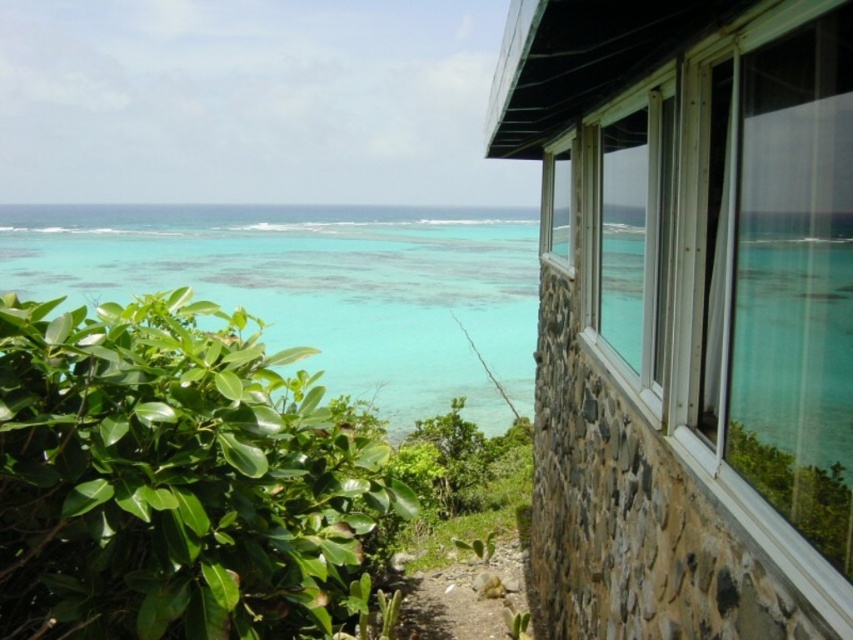
Does translucent water at lower left have a lesser height compared to clear glass window at upper right?

No, translucent water at lower left is not shorter than clear glass window at upper right.

Which is more to the right, translucent water at lower left or clear glass window at upper right?

Positioned to the right is clear glass window at upper right.

Where is `translucent water at lower left`? translucent water at lower left is located at coordinates (318, 288).

From the picture: Between green spiky cactus at lower center and clear glass window at upper right, which one is positioned higher?

clear glass window at upper right

Who is positioned more to the left, green spiky cactus at lower center or clear glass window at upper right?

green spiky cactus at lower center is more to the left.

The height and width of the screenshot is (640, 853). What do you see at coordinates (467, 595) in the screenshot?
I see `green spiky cactus at lower center` at bounding box center [467, 595].

At what (x,y) coordinates should I click in order to perform the action: click on green spiky cactus at lower center. Please return your answer as a coordinate pair (x, y). Looking at the image, I should click on (467, 595).

Is point (337, 237) more distant than point (459, 588)?

Yes, it is.

Is translucent water at lower left below green spiky cactus at lower center?

No.

Does point (73, 244) come farther from viewer compared to point (483, 576)?

Yes.

Find the location of a particular element. translucent water at lower left is located at coordinates (318, 288).